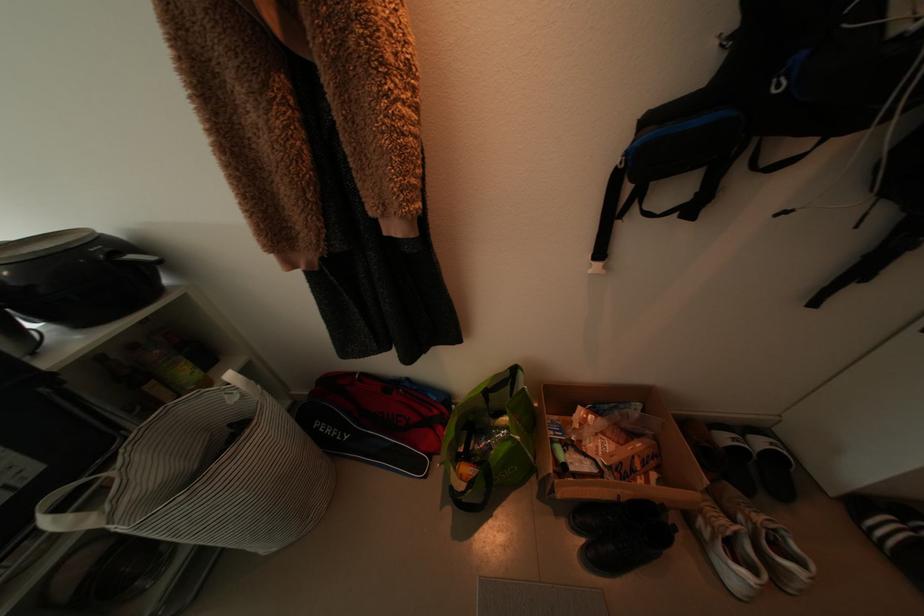
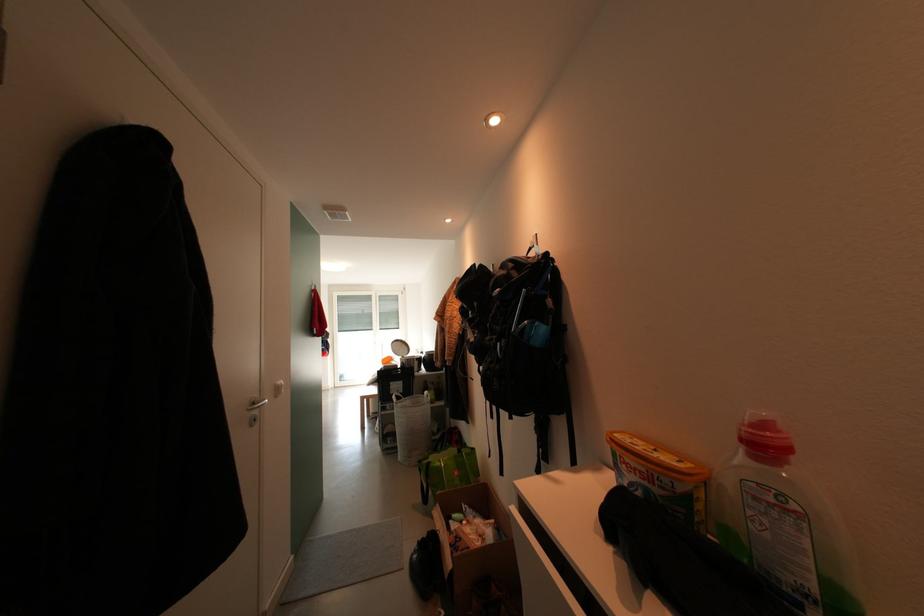
The point at (153, 467) is marked in the first image. Where is the corresponding point in the second image?

(415, 405)